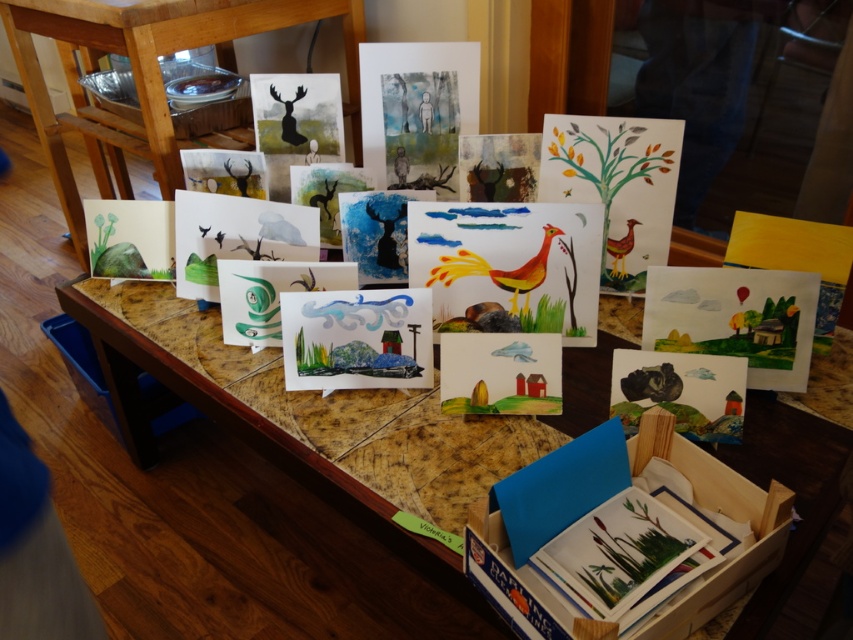
Question: Is wooden table at center wider than wooden table at upper left?

Choices:
 (A) no
 (B) yes

Answer: (B)

Question: Which point appears closest to the camera in this image?

Choices:
 (A) (288, 348)
 (B) (619, 241)

Answer: (A)

Question: Which point appears closest to the camera in this image?

Choices:
 (A) (299, 93)
 (B) (294, 369)

Answer: (B)

Question: Which of the following is the farthest from the observer?

Choices:
 (A) (618, 241)
 (B) (286, 109)
 (C) (111, 1)

Answer: (C)

Question: Is watercolor painting at center smaller than matte orange bird at right?

Choices:
 (A) no
 (B) yes

Answer: (A)

Question: In this image, where is watercolor painting at center located relative to matte orange bird at right?

Choices:
 (A) left
 (B) right

Answer: (A)